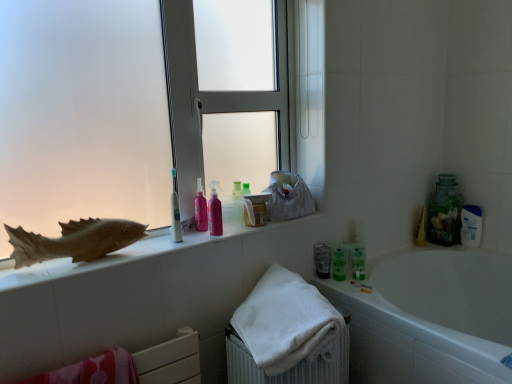
Question: From the image's perspective, would you say pink glossy lotion at center, arranged as the first toiletry when viewed from the front, is shown under clear glass jar at upper right?

Choices:
 (A) yes
 (B) no

Answer: (B)

Question: Does pink glossy lotion at center, the 1th toiletry when ordered from left to right, turn towards clear glass jar at upper right?

Choices:
 (A) no
 (B) yes

Answer: (A)

Question: From the image's perspective, would you say pink glossy lotion at center, which appears as the first toiletry when viewed from the top, is positioned over clear glass jar at upper right?

Choices:
 (A) no
 (B) yes

Answer: (B)

Question: Is pink glossy lotion at center, the 1th toiletry when ordered from left to right, looking in the opposite direction of clear glass jar at upper right?

Choices:
 (A) yes
 (B) no

Answer: (B)

Question: Is pink glossy lotion at center, the 1th toiletry when ordered from left to right, with clear glass jar at upper right?

Choices:
 (A) yes
 (B) no

Answer: (B)

Question: Is pink glossy mouthwash at center, the third mouthwash when ordered from back to front, situated inside brown matte fish at left or outside?

Choices:
 (A) inside
 (B) outside

Answer: (B)

Question: Considering their positions, is pink glossy mouthwash at center, which is counted as the 3th mouthwash, starting from the right, located in front of or behind brown matte fish at left?

Choices:
 (A) front
 (B) behind

Answer: (B)

Question: From a real-world perspective, is pink glossy mouthwash at center, which is counted as the 3th mouthwash, starting from the right, positioned above or below brown matte fish at left?

Choices:
 (A) below
 (B) above

Answer: (B)

Question: Is pink glossy mouthwash at center, placed as the 1th mouthwash when sorted from front to back, taller or shorter than brown matte fish at left?

Choices:
 (A) short
 (B) tall

Answer: (B)

Question: Which is correct: pink glossy lotion at center, the second toiletry positioned from the back, is inside white glossy bathtub at lower right, or outside of it?

Choices:
 (A) outside
 (B) inside

Answer: (A)

Question: Considering their positions, is pink glossy lotion at center, which is counted as the 2th toiletry, starting from the bottom, located in front of or behind white glossy bathtub at lower right?

Choices:
 (A) front
 (B) behind

Answer: (B)

Question: Visually, is pink glossy lotion at center, the 2th toiletry from the right, positioned to the left or to the right of white glossy bathtub at lower right?

Choices:
 (A) right
 (B) left

Answer: (B)

Question: From a real-world perspective, relative to white glossy bathtub at lower right, is pink glossy lotion at center, the second toiletry positioned from the back, vertically above or below?

Choices:
 (A) above
 (B) below

Answer: (A)

Question: Based on their positions, is white glossy bathtub at lower right located to the left or right of clear glass jar at upper right?

Choices:
 (A) left
 (B) right

Answer: (A)

Question: From a real-world perspective, is white glossy bathtub at lower right physically located above or below clear glass jar at upper right?

Choices:
 (A) below
 (B) above

Answer: (A)